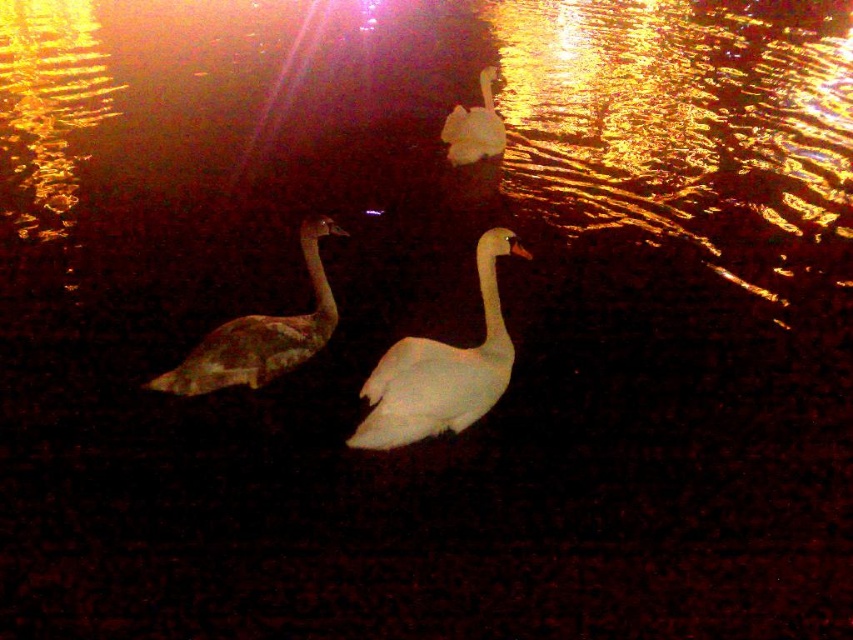
Can you confirm if white glossy swan at center is shorter than white glossy swan at upper center?

Incorrect, white glossy swan at center's height does not fall short of white glossy swan at upper center's.

Which is more to the left, white glossy swan at center or white glossy swan at upper center?

Positioned to the left is white glossy swan at center.

The width and height of the screenshot is (853, 640). Describe the element at coordinates (440, 369) in the screenshot. I see `white glossy swan at center` at that location.

Find the location of a particular element. white glossy swan at center is located at coordinates (440, 369).

Which is above, brown speckled goose at left or white glossy swan at upper center?

white glossy swan at upper center is above.

Is brown speckled goose at left further to camera compared to white glossy swan at upper center?

No, it is in front of white glossy swan at upper center.

What do you see at coordinates (260, 333) in the screenshot? I see `brown speckled goose at left` at bounding box center [260, 333].

At what (x,y) coordinates should I click in order to perform the action: click on brown speckled goose at left. Please return your answer as a coordinate pair (x, y). The height and width of the screenshot is (640, 853). Looking at the image, I should click on (260, 333).

Looking at this image, between white glossy swan at center and brown speckled goose at left, which one has more height?

With more height is white glossy swan at center.

This screenshot has height=640, width=853. What do you see at coordinates (440, 369) in the screenshot?
I see `white glossy swan at center` at bounding box center [440, 369].

Where is `white glossy swan at center`? The width and height of the screenshot is (853, 640). white glossy swan at center is located at coordinates (440, 369).